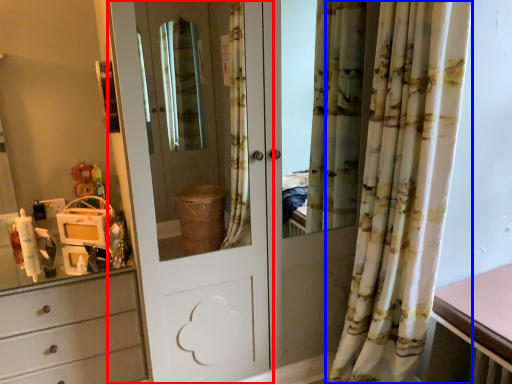
Question: Which object appears closest to the camera in this image, door (highlighted by a red box) or curtain (highlighted by a blue box)?

Choices:
 (A) door
 (B) curtain

Answer: (B)